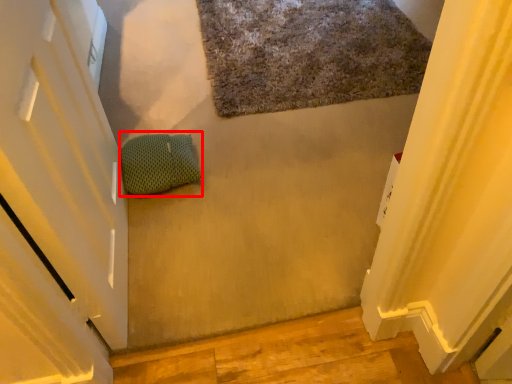
Question: Considering the relative positions of pillow (annotated by the red box) and bath mat in the image provided, where is pillow (annotated by the red box) located with respect to the staircase?

Choices:
 (A) left
 (B) right

Answer: (A)